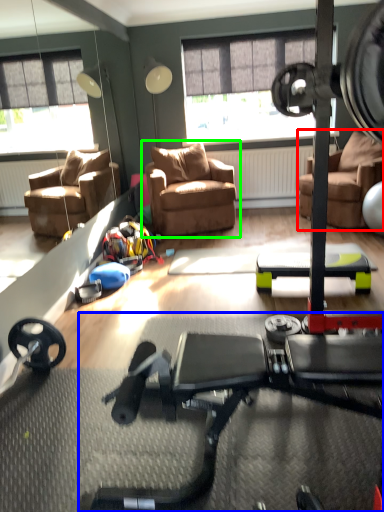
Question: Based on their relative distances, which object is farther from chair (highlighted by a red box)? Choose from stationary bicycle (highlighted by a blue box) and chair (highlighted by a green box).

Choices:
 (A) stationary bicycle
 (B) chair

Answer: (A)